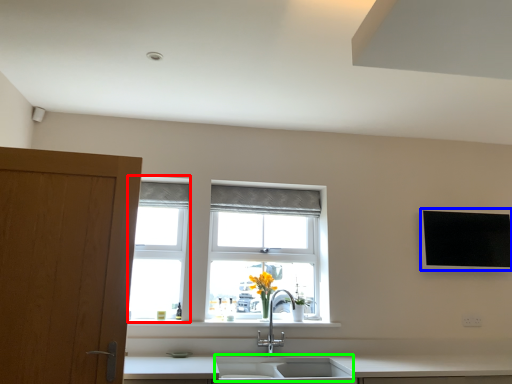
Question: Based on their relative distances, which object is farther from window frame (highlighted by a red box)? Choose from flat (highlighted by a blue box) and sink (highlighted by a green box).

Choices:
 (A) flat
 (B) sink

Answer: (A)